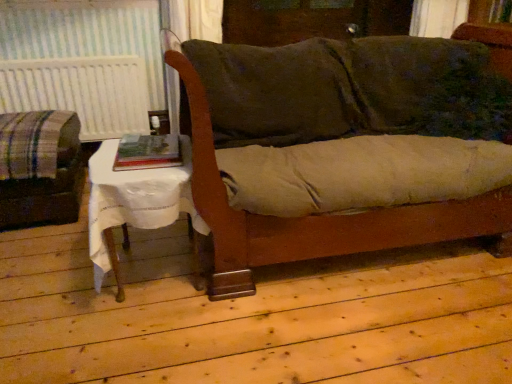
Question: Does white cloth-covered table at lower left have a lesser height compared to velvet green couch at center?

Choices:
 (A) no
 (B) yes

Answer: (B)

Question: Considering the relative sizes of white cloth-covered table at lower left and velvet green couch at center in the image provided, is white cloth-covered table at lower left taller than velvet green couch at center?

Choices:
 (A) yes
 (B) no

Answer: (B)

Question: From the image's perspective, is white cloth-covered table at lower left below velvet green couch at center?

Choices:
 (A) no
 (B) yes

Answer: (B)

Question: From a real-world perspective, is white cloth-covered table at lower left over velvet green couch at center?

Choices:
 (A) no
 (B) yes

Answer: (A)

Question: Considering the relative positions of white cloth-covered table at lower left and velvet green couch at center in the image provided, is white cloth-covered table at lower left to the right of velvet green couch at center from the viewer's perspective?

Choices:
 (A) yes
 (B) no

Answer: (B)

Question: Is point (34, 198) positioned closer to the camera than point (132, 208)?

Choices:
 (A) farther
 (B) closer

Answer: (A)

Question: In terms of size, does plaid fabric couch at left appear bigger or smaller than white cloth-covered table at lower left?

Choices:
 (A) small
 (B) big

Answer: (B)

Question: From a real-world perspective, is plaid fabric couch at left physically located above or below white cloth-covered table at lower left?

Choices:
 (A) above
 (B) below

Answer: (B)

Question: From the image's perspective, is plaid fabric couch at left above or below white cloth-covered table at lower left?

Choices:
 (A) below
 (B) above

Answer: (B)

Question: Considering the positions of white cloth-covered table at lower left and velvet green couch at center in the image, is white cloth-covered table at lower left wider or thinner than velvet green couch at center?

Choices:
 (A) wide
 (B) thin

Answer: (B)

Question: In the image, is white cloth-covered table at lower left on the left side or the right side of velvet green couch at center?

Choices:
 (A) left
 (B) right

Answer: (A)

Question: In the image, is white cloth-covered table at lower left positioned in front of or behind velvet green couch at center?

Choices:
 (A) behind
 (B) front

Answer: (A)

Question: Based on their sizes in the image, would you say white cloth-covered table at lower left is bigger or smaller than velvet green couch at center?

Choices:
 (A) small
 (B) big

Answer: (A)

Question: In the image, is velvet green couch at center positioned in front of or behind white textured radiator at left?

Choices:
 (A) behind
 (B) front

Answer: (B)

Question: From a real-world perspective, is velvet green couch at center above or below white textured radiator at left?

Choices:
 (A) above
 (B) below

Answer: (A)